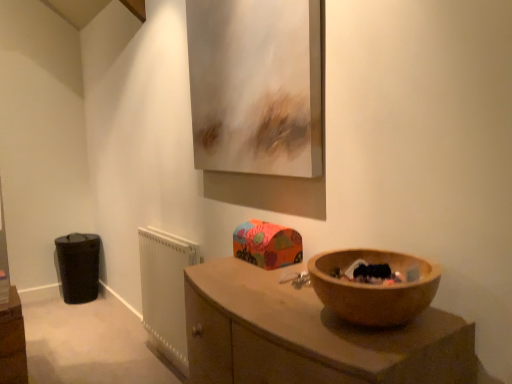
Image resolution: width=512 pixels, height=384 pixels. What are the coordinates of `metallic silver picture frame at upper center` in the screenshot? It's located at (256, 85).

What do you see at coordinates (78, 267) in the screenshot? I see `black fabric bag at lower left` at bounding box center [78, 267].

Locate an element on the screen. This screenshot has height=384, width=512. wooden at lower right is located at coordinates (309, 336).

This screenshot has height=384, width=512. I want to click on metallic silver picture frame at upper center, so click(256, 85).

Considering the sizes of objects wooden at lower right and metallic silver picture frame at upper center in the image provided, who is taller, wooden at lower right or metallic silver picture frame at upper center?

metallic silver picture frame at upper center is taller.

The image size is (512, 384). What are the coordinates of `picture frame on the left of wooden at lower right` in the screenshot? It's located at (256, 85).

From the image's perspective, is wooden at lower right located beneath metallic silver picture frame at upper center?

Indeed, from the image's perspective, wooden at lower right is shown beneath metallic silver picture frame at upper center.

Which is more distant, (356,375) or (199,91)?

Positioned behind is point (199,91).

From a real-world perspective, which is physically below, metallic silver picture frame at upper center or white plastic radiator at lower left?

From a 3D spatial view, white plastic radiator at lower left is below.

At what (x,y) coordinates should I click in order to perform the action: click on radiator lying behind the metallic silver picture frame at upper center. Please return your answer as a coordinate pair (x, y). Image resolution: width=512 pixels, height=384 pixels. Looking at the image, I should click on (165, 291).

Who is shorter, metallic silver picture frame at upper center or white plastic radiator at lower left?

white plastic radiator at lower left.

Could you measure the distance between metallic silver picture frame at upper center and white plastic radiator at lower left?

metallic silver picture frame at upper center is 3.41 feet from white plastic radiator at lower left.

How many degrees apart are the facing directions of metallic silver picture frame at upper center and black fabric bag at lower left?

The angular difference between metallic silver picture frame at upper center and black fabric bag at lower left is 90.3 degrees.

Consider the image. Considering the sizes of metallic silver picture frame at upper center and black fabric bag at lower left in the image, is metallic silver picture frame at upper center wider or thinner than black fabric bag at lower left?

metallic silver picture frame at upper center is thinner than black fabric bag at lower left.

Is metallic silver picture frame at upper center placed right next to black fabric bag at lower left?

There is a gap between metallic silver picture frame at upper center and black fabric bag at lower left.

From the image's perspective, which one is positioned lower, metallic silver picture frame at upper center or black fabric bag at lower left?

black fabric bag at lower left is shown below in the image.

Is wooden at lower right facing away from black fabric bag at lower left?

No, black fabric bag at lower left is not at the back of wooden at lower right.

In the scene shown: Between wooden at lower right and black fabric bag at lower left, which one has larger size?

wooden at lower right.

Does wooden at lower right lie in front of black fabric bag at lower left?

Yes, wooden at lower right is closer to the camera.

Locate an element on the screen. Image resolution: width=512 pixels, height=384 pixels. cabinetry that appears below the wooden at lower right (from a real-world perspective) is located at coordinates (78, 267).

How much distance is there between wooden at lower right and white plastic radiator at lower left?

The distance of wooden at lower right from white plastic radiator at lower left is 1.19 meters.

This screenshot has width=512, height=384. Identify the location of radiator behind the wooden at lower right. point(165,291).

Which of these two, wooden at lower right or white plastic radiator at lower left, is smaller?

Smaller between the two is white plastic radiator at lower left.

What's the angular difference between wooden at lower right and white plastic radiator at lower left's facing directions?

The angular difference between wooden at lower right and white plastic radiator at lower left is 2.2 degrees.

Between black fabric bag at lower left and white plastic radiator at lower left, which one has larger size?

With larger size is black fabric bag at lower left.

Who is shorter, black fabric bag at lower left or white plastic radiator at lower left?

Standing shorter between the two is black fabric bag at lower left.

Which object is wider, black fabric bag at lower left or white plastic radiator at lower left?

black fabric bag at lower left.

Based on the photo, which of these two, white plastic radiator at lower left or black fabric bag at lower left, stands shorter?

With less height is black fabric bag at lower left.

From a real-world perspective, relative to black fabric bag at lower left, is white plastic radiator at lower left vertically above or below?

In terms of real-world spatial position, white plastic radiator at lower left is above black fabric bag at lower left.

Is point (146, 296) positioned after point (94, 281)?

No, it is in front of (94, 281).

Do you think white plastic radiator at lower left is within black fabric bag at lower left, or outside of it?

The correct answer is: outside.

At what (x,y) coordinates should I click in order to perform the action: click on countertop that is in front of the metallic silver picture frame at upper center. Please return your answer as a coordinate pair (x, y). This screenshot has width=512, height=384. Looking at the image, I should click on (309, 336).

I want to click on picture frame lying above the white plastic radiator at lower left (from the image's perspective), so click(x=256, y=85).

Estimate the real-world distances between objects in this image. Which object is further from black fabric bag at lower left, white plastic radiator at lower left or wooden at lower right?

Among the two, wooden at lower right is located further to black fabric bag at lower left.

Based on their spatial positions, is white plastic radiator at lower left or black fabric bag at lower left further from wooden at lower right?

The object further to wooden at lower right is black fabric bag at lower left.

Estimate the real-world distances between objects in this image. Which object is closer to metallic silver picture frame at upper center, black fabric bag at lower left or white plastic radiator at lower left?

white plastic radiator at lower left is closer to metallic silver picture frame at upper center.

Estimate the real-world distances between objects in this image. Which object is further from metallic silver picture frame at upper center, black fabric bag at lower left or wooden at lower right?

black fabric bag at lower left is further to metallic silver picture frame at upper center.

Considering their positions, is white plastic radiator at lower left positioned further to metallic silver picture frame at upper center than wooden at lower right?

white plastic radiator at lower left lies further to metallic silver picture frame at upper center than the other object.

Based on their spatial positions, is wooden at lower right or black fabric bag at lower left closer to metallic silver picture frame at upper center?

Among the two, wooden at lower right is located nearer to metallic silver picture frame at upper center.

Which object lies further to the anchor point black fabric bag at lower left, metallic silver picture frame at upper center or wooden at lower right?

The object further to black fabric bag at lower left is wooden at lower right.

Considering their positions, is white plastic radiator at lower left positioned closer to wooden at lower right than metallic silver picture frame at upper center?

metallic silver picture frame at upper center.

The image size is (512, 384). What are the coordinates of `radiator located between metallic silver picture frame at upper center and black fabric bag at lower left in the depth direction` in the screenshot? It's located at coord(165,291).

You are a GUI agent. You are given a task and a screenshot of the screen. Output one action in this format:
    pyautogui.click(x=<x>, y=<y>)
    Task: Click on the picture frame between wooden at lower right and black fabric bag at lower left along the z-axis
    Image resolution: width=512 pixels, height=384 pixels.
    Given the screenshot: What is the action you would take?
    pyautogui.click(x=256, y=85)

The height and width of the screenshot is (384, 512). I want to click on radiator between wooden at lower right and black fabric bag at lower left along the z-axis, so click(x=165, y=291).

This screenshot has height=384, width=512. Identify the location of picture frame positioned between wooden at lower right and white plastic radiator at lower left from near to far. (256, 85).